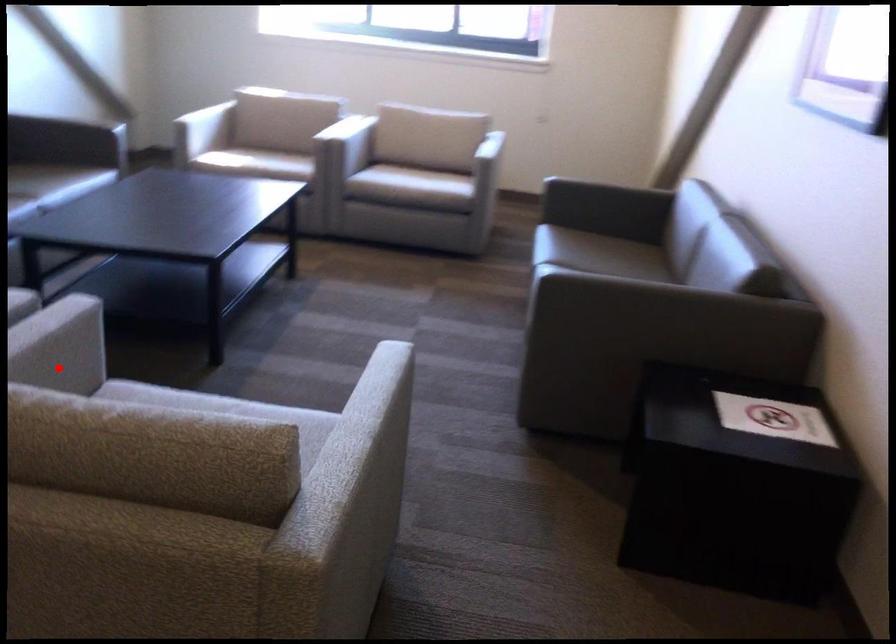
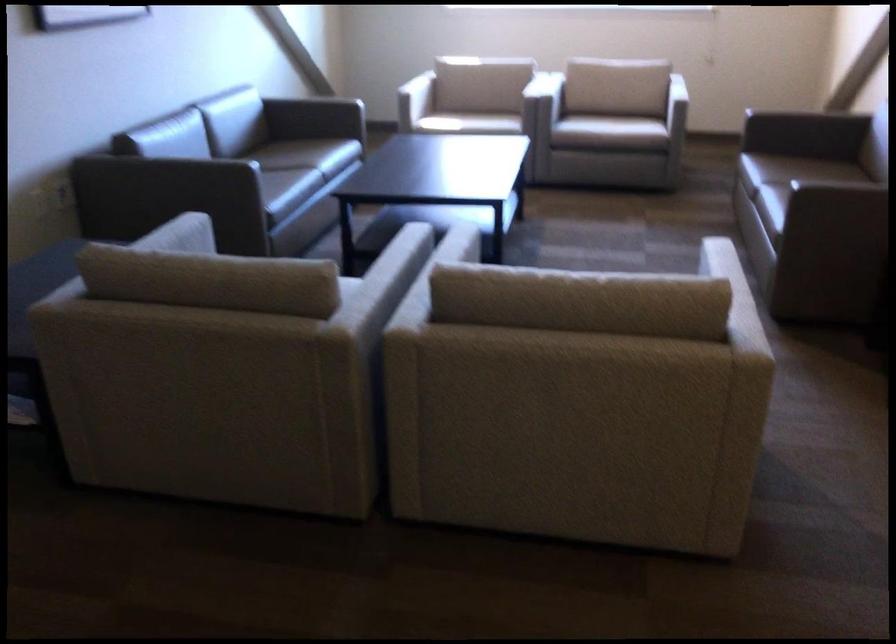
Question: I am providing you with two images of the same scene from different viewpoints. A red point is marked on the first image. Can you still see the location of the red point in image 2?

Choices:
 (A) Yes
 (B) No

Answer: (B)